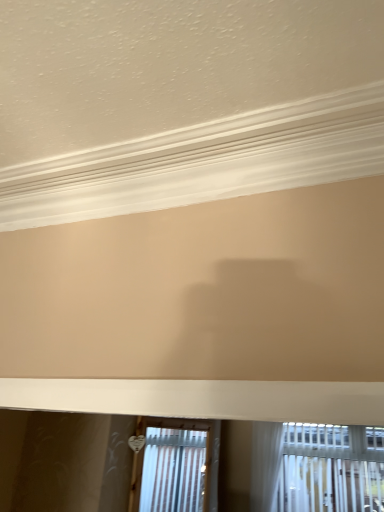
Describe the element at coordinates (265, 464) in the screenshot. The width and height of the screenshot is (384, 512). I see `white sheer curtain at lower center` at that location.

Identify the location of white sheer curtain at lower center. This screenshot has height=512, width=384. (265, 464).

Locate an element on the screen. This screenshot has height=512, width=384. white sheer curtain at lower center is located at coordinates (265, 464).